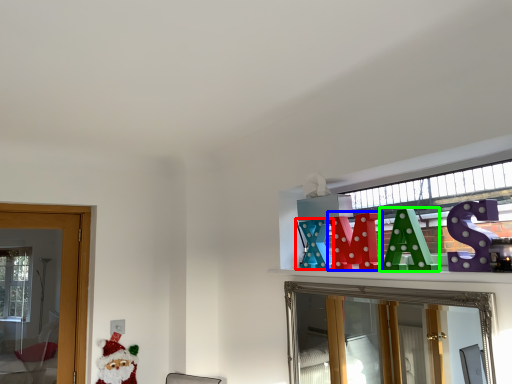
Question: Which object is positioned farthest from toy (highlighted by a red box)? Select from toy (highlighted by a blue box) and toy (highlighted by a green box).

Choices:
 (A) toy
 (B) toy

Answer: (B)